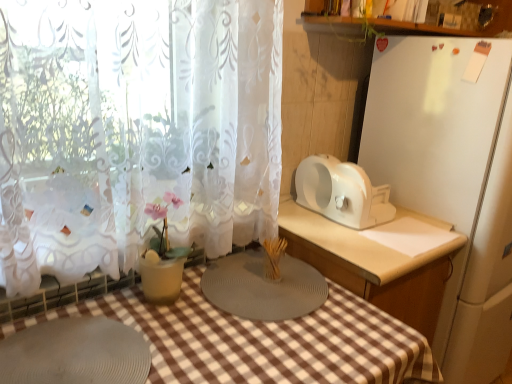
Question: From a real-world perspective, is gray rubber mat at lower left under gray rubber placemat at center, which is the first appliance in left-to-right order?

Choices:
 (A) no
 (B) yes

Answer: (B)

Question: Is gray rubber mat at lower left shorter than gray rubber placemat at center, placed as the third appliance when sorted from right to left?

Choices:
 (A) yes
 (B) no

Answer: (A)

Question: Is gray rubber mat at lower left far away from gray rubber placemat at center, placed as the third appliance when sorted from right to left?

Choices:
 (A) no
 (B) yes

Answer: (A)

Question: Is gray rubber mat at lower left to the right of gray rubber placemat at center, which is the first appliance in left-to-right order, from the viewer's perspective?

Choices:
 (A) no
 (B) yes

Answer: (A)

Question: Could you tell me if gray rubber mat at lower left is facing gray rubber placemat at center, placed as the third appliance when sorted from right to left?

Choices:
 (A) yes
 (B) no

Answer: (B)

Question: From the image's perspective, relative to white lace curtain at left, is gray rubber placemat at center, which is the first appliance in left-to-right order, above or below?

Choices:
 (A) above
 (B) below

Answer: (B)

Question: From a real-world perspective, is gray rubber placemat at center, which is the first appliance in left-to-right order, positioned above or below white lace curtain at left?

Choices:
 (A) below
 (B) above

Answer: (A)

Question: Considering the positions of gray rubber placemat at center, placed as the third appliance when sorted from right to left, and white lace curtain at left in the image, is gray rubber placemat at center, placed as the third appliance when sorted from right to left, bigger or smaller than white lace curtain at left?

Choices:
 (A) small
 (B) big

Answer: (A)

Question: Considering the positions of point (269, 319) and point (133, 263), is point (269, 319) closer or farther from the camera than point (133, 263)?

Choices:
 (A) closer
 (B) farther

Answer: (A)

Question: Do you think gray rubber placemat at center, placed as the third appliance when sorted from right to left, is within gray rubber mat at lower left, or outside of it?

Choices:
 (A) outside
 (B) inside

Answer: (A)

Question: From the image's perspective, is gray rubber placemat at center, which is the first appliance in left-to-right order, above or below gray rubber mat at lower left?

Choices:
 (A) above
 (B) below

Answer: (A)

Question: Considering the positions of gray rubber placemat at center, placed as the third appliance when sorted from right to left, and gray rubber mat at lower left in the image, is gray rubber placemat at center, placed as the third appliance when sorted from right to left, taller or shorter than gray rubber mat at lower left?

Choices:
 (A) short
 (B) tall

Answer: (B)

Question: Considering their positions, is gray rubber placemat at center, placed as the third appliance when sorted from right to left, located in front of or behind gray rubber mat at lower left?

Choices:
 (A) front
 (B) behind

Answer: (B)

Question: Is gray rubber mat at lower left inside the boundaries of white plastic toaster at right, marked as the 3th appliance in a left-to-right arrangement, or outside?

Choices:
 (A) outside
 (B) inside

Answer: (A)

Question: Looking at their shapes, would you say gray rubber mat at lower left is wider or thinner than white plastic toaster at right, marked as the 3th appliance in a left-to-right arrangement?

Choices:
 (A) wide
 (B) thin

Answer: (B)